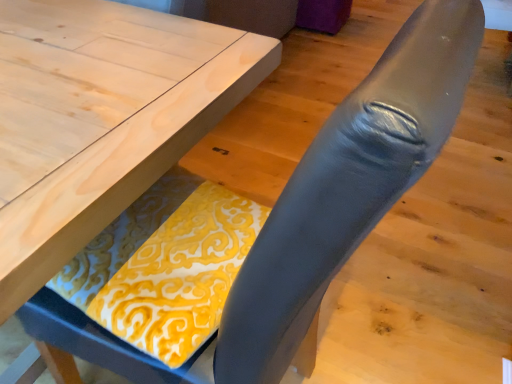
Question: From a real-world perspective, is yellow printed fabric at lower center physically below light wood table at center?

Choices:
 (A) no
 (B) yes

Answer: (A)

Question: Would you say yellow printed fabric at lower center contains light wood table at center?

Choices:
 (A) yes
 (B) no

Answer: (B)

Question: From the image's perspective, is yellow printed fabric at lower center above light wood table at center?

Choices:
 (A) no
 (B) yes

Answer: (A)

Question: Is yellow printed fabric at lower center at the left side of light wood table at center?

Choices:
 (A) yes
 (B) no

Answer: (B)

Question: Would you consider yellow printed fabric at lower center to be distant from light wood table at center?

Choices:
 (A) yes
 (B) no

Answer: (B)

Question: Does yellow printed fabric at lower center lie in front of light wood table at center?

Choices:
 (A) no
 (B) yes

Answer: (A)

Question: Considering the relative sizes of light wood table at center and yellow printed fabric at lower center in the image provided, is light wood table at center smaller than yellow printed fabric at lower center?

Choices:
 (A) yes
 (B) no

Answer: (B)

Question: Is light wood table at center at the left side of yellow printed fabric at lower center?

Choices:
 (A) no
 (B) yes

Answer: (B)

Question: From the image's perspective, is light wood table at center on top of yellow printed fabric at lower center?

Choices:
 (A) no
 (B) yes

Answer: (B)

Question: Is light wood table at center next to yellow printed fabric at lower center?

Choices:
 (A) yes
 (B) no

Answer: (B)

Question: From the image's perspective, is light wood table at center beneath yellow printed fabric at lower center?

Choices:
 (A) no
 (B) yes

Answer: (A)

Question: Considering the relative sizes of light wood table at center and yellow printed fabric at lower center in the image provided, is light wood table at center thinner than yellow printed fabric at lower center?

Choices:
 (A) no
 (B) yes

Answer: (A)

Question: From the image's perspective, is light wood table at center above or below yellow printed fabric at lower center?

Choices:
 (A) below
 (B) above

Answer: (B)